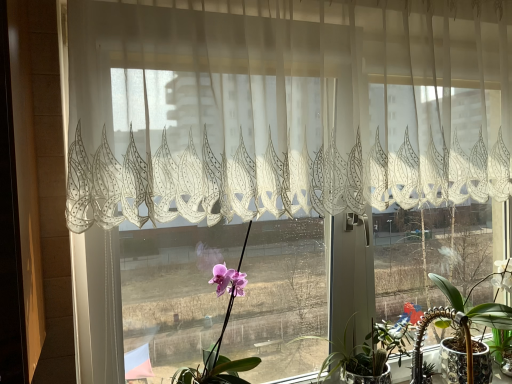
In order to face translucent white lace curtain at upper center, should I rotate leftwards or rightwards?

Turn right approximately 11.811 degrees to face it.

Describe the element at coordinates (475, 306) in the screenshot. I see `white glossy pot at lower right, marked as the third houseplant in a left-to-right arrangement` at that location.

At what (x,y) coordinates should I click in order to perform the action: click on green glossy succulent at lower right, the second houseplant positioned from the right. Please return your answer as a coordinate pair (x, y). Looking at the image, I should click on (371, 350).

Is white glossy pot at lower right, the 1th houseplant in the right-to-left sequence, inside pink matte orchid at center, which is the 3th houseplant in right-to-left order?

No, white glossy pot at lower right, the 1th houseplant in the right-to-left sequence, is not inside pink matte orchid at center, which is the 3th houseplant in right-to-left order.

This screenshot has width=512, height=384. Identify the location of houseplant that is the 2nd object to the left of the white glossy pot at lower right, marked as the third houseplant in a left-to-right arrangement, starting at the anchor. (222, 331).

Measure the distance between pink matte orchid at center, which ranks as the 1th houseplant in left-to-right order, and white glossy pot at lower right, the 1th houseplant in the right-to-left sequence.

They are 29.45 inches apart.

Considering the relative sizes of pink matte orchid at center, which ranks as the 1th houseplant in left-to-right order, and white glossy pot at lower right, the 1th houseplant in the right-to-left sequence, in the image provided, is pink matte orchid at center, which ranks as the 1th houseplant in left-to-right order, bigger than white glossy pot at lower right, the 1th houseplant in the right-to-left sequence,?

Indeed, pink matte orchid at center, which ranks as the 1th houseplant in left-to-right order, has a larger size compared to white glossy pot at lower right, the 1th houseplant in the right-to-left sequence.

What's the angular difference between pink matte orchid at center, which is the 3th houseplant in right-to-left order, and green glossy succulent at lower right, the second houseplant positioned from the right,'s facing directions?

0.000122 degrees separate the facing orientations of pink matte orchid at center, which is the 3th houseplant in right-to-left order, and green glossy succulent at lower right, the second houseplant positioned from the right.

Is pink matte orchid at center, which is the 3th houseplant in right-to-left order, directly adjacent to green glossy succulent at lower right, which ranks as the 2th houseplant in left-to-right order?

No, pink matte orchid at center, which is the 3th houseplant in right-to-left order, is not beside green glossy succulent at lower right, which ranks as the 2th houseplant in left-to-right order.

Considering the sizes of objects pink matte orchid at center, which ranks as the 1th houseplant in left-to-right order, and green glossy succulent at lower right, which ranks as the 2th houseplant in left-to-right order, in the image provided, who is wider, pink matte orchid at center, which ranks as the 1th houseplant in left-to-right order, or green glossy succulent at lower right, which ranks as the 2th houseplant in left-to-right order,?

Wider between the two is pink matte orchid at center, which ranks as the 1th houseplant in left-to-right order.

There is a green glossy succulent at lower right, which ranks as the 2th houseplant in left-to-right order. At what (x,y) coordinates should I click in order to perform the action: click on the 2nd houseplant above it (from a real-world perspective). Please return your answer as a coordinate pair (x, y). Looking at the image, I should click on (222, 331).

Is translucent white lace curtain at upper center situated inside white glossy pot at lower right, the 1th houseplant in the right-to-left sequence, or outside?

translucent white lace curtain at upper center is not inside white glossy pot at lower right, the 1th houseplant in the right-to-left sequence, it's outside.

Which is more to the left, translucent white lace curtain at upper center or white glossy pot at lower right, marked as the third houseplant in a left-to-right arrangement?

From the viewer's perspective, translucent white lace curtain at upper center appears more on the left side.

Who is bigger, translucent white lace curtain at upper center or white glossy pot at lower right, the 1th houseplant in the right-to-left sequence?

translucent white lace curtain at upper center is bigger.

Considering their positions, is translucent white lace curtain at upper center located in front of or behind white glossy pot at lower right, marked as the third houseplant in a left-to-right arrangement?

translucent white lace curtain at upper center is positioned closer to the viewer than white glossy pot at lower right, marked as the third houseplant in a left-to-right arrangement.

This screenshot has height=384, width=512. What are the coordinates of `the 1st houseplant counting from the left side of the white glossy pot at lower right, the 1th houseplant in the right-to-left sequence` in the screenshot? It's located at (371, 350).

Does green glossy succulent at lower right, the second houseplant positioned from the right, have a lesser height compared to white glossy pot at lower right, marked as the third houseplant in a left-to-right arrangement?

Yes, green glossy succulent at lower right, the second houseplant positioned from the right, is shorter than white glossy pot at lower right, marked as the third houseplant in a left-to-right arrangement.

Is the position of green glossy succulent at lower right, which ranks as the 2th houseplant in left-to-right order, less distant than that of white glossy pot at lower right, the 1th houseplant in the right-to-left sequence?

Yes.

Do you think green glossy succulent at lower right, the second houseplant positioned from the right, is within white glossy pot at lower right, the 1th houseplant in the right-to-left sequence, or outside of it?

green glossy succulent at lower right, the second houseplant positioned from the right, lies outside white glossy pot at lower right, the 1th houseplant in the right-to-left sequence.

In the scene shown: From the image's perspective, does green glossy succulent at lower right, which ranks as the 2th houseplant in left-to-right order, appear lower than pink matte orchid at center, which ranks as the 1th houseplant in left-to-right order?

Correct, green glossy succulent at lower right, which ranks as the 2th houseplant in left-to-right order, appears lower than pink matte orchid at center, which ranks as the 1th houseplant in left-to-right order, in the image.

In the scene shown: Choose the correct answer: Is green glossy succulent at lower right, which ranks as the 2th houseplant in left-to-right order, inside pink matte orchid at center, which is the 3th houseplant in right-to-left order, or outside it?

green glossy succulent at lower right, which ranks as the 2th houseplant in left-to-right order, lies outside pink matte orchid at center, which is the 3th houseplant in right-to-left order.

Where is `houseplant to the left of green glossy succulent at lower right, which ranks as the 2th houseplant in left-to-right order`? houseplant to the left of green glossy succulent at lower right, which ranks as the 2th houseplant in left-to-right order is located at coordinates (222, 331).

Which object is further away from the camera taking this photo, green glossy succulent at lower right, which ranks as the 2th houseplant in left-to-right order, or pink matte orchid at center, which ranks as the 1th houseplant in left-to-right order?

Positioned behind is green glossy succulent at lower right, which ranks as the 2th houseplant in left-to-right order.

Considering the sizes of objects green glossy succulent at lower right, the second houseplant positioned from the right, and translucent white lace curtain at upper center in the image provided, who is wider, green glossy succulent at lower right, the second houseplant positioned from the right, or translucent white lace curtain at upper center?

With larger width is green glossy succulent at lower right, the second houseplant positioned from the right.

Locate an element on the screen. This screenshot has width=512, height=384. curtain that appears in front of the green glossy succulent at lower right, the second houseplant positioned from the right is located at coordinates (283, 111).

Measure the distance from green glossy succulent at lower right, which ranks as the 2th houseplant in left-to-right order, to translucent white lace curtain at upper center.

The distance of green glossy succulent at lower right, which ranks as the 2th houseplant in left-to-right order, from translucent white lace curtain at upper center is 29.16 inches.

From the image's perspective, is green glossy succulent at lower right, which ranks as the 2th houseplant in left-to-right order, on translucent white lace curtain at upper center?

No, from the image's perspective, green glossy succulent at lower right, which ranks as the 2th houseplant in left-to-right order, is not above translucent white lace curtain at upper center.

From the image's perspective, is pink matte orchid at center, which ranks as the 1th houseplant in left-to-right order, over translucent white lace curtain at upper center?

No.

Who is taller, pink matte orchid at center, which ranks as the 1th houseplant in left-to-right order, or translucent white lace curtain at upper center?

translucent white lace curtain at upper center is taller.

Which is behind, pink matte orchid at center, which ranks as the 1th houseplant in left-to-right order, or translucent white lace curtain at upper center?

pink matte orchid at center, which ranks as the 1th houseplant in left-to-right order, is further from the camera.

From a real-world perspective, is pink matte orchid at center, which is the 3th houseplant in right-to-left order, beneath translucent white lace curtain at upper center?

Yes, from a real-world perspective, pink matte orchid at center, which is the 3th houseplant in right-to-left order, is beneath translucent white lace curtain at upper center.

From the image's perspective, which houseplant is the 1st one below the pink matte orchid at center, which ranks as the 1th houseplant in left-to-right order? Please provide its 2D coordinates.

[(475, 306)]

I want to click on the 1st houseplant to the right of the pink matte orchid at center, which ranks as the 1th houseplant in left-to-right order, counting from the anchor's position, so click(371, 350).

Based on their spatial positions, is green glossy succulent at lower right, the second houseplant positioned from the right, or pink matte orchid at center, which ranks as the 1th houseplant in left-to-right order, further from translucent white lace curtain at upper center?

green glossy succulent at lower right, the second houseplant positioned from the right, lies further to translucent white lace curtain at upper center than the other object.

From the image, which object appears to be nearer to green glossy succulent at lower right, the second houseplant positioned from the right, translucent white lace curtain at upper center or pink matte orchid at center, which ranks as the 1th houseplant in left-to-right order?

Based on the image, pink matte orchid at center, which ranks as the 1th houseplant in left-to-right order, appears to be nearer to green glossy succulent at lower right, the second houseplant positioned from the right.

When comparing their distances from white glossy pot at lower right, the 1th houseplant in the right-to-left sequence, does translucent white lace curtain at upper center or green glossy succulent at lower right, which ranks as the 2th houseplant in left-to-right order, seem further?

translucent white lace curtain at upper center lies further to white glossy pot at lower right, the 1th houseplant in the right-to-left sequence, than the other object.

Considering their positions, is pink matte orchid at center, which is the 3th houseplant in right-to-left order, positioned further to white glossy pot at lower right, marked as the third houseplant in a left-to-right arrangement, than green glossy succulent at lower right, which ranks as the 2th houseplant in left-to-right order?

pink matte orchid at center, which is the 3th houseplant in right-to-left order, is further to white glossy pot at lower right, marked as the third houseplant in a left-to-right arrangement.

Looking at the image, which one is located closer to green glossy succulent at lower right, which ranks as the 2th houseplant in left-to-right order, pink matte orchid at center, which is the 3th houseplant in right-to-left order, or white glossy pot at lower right, marked as the third houseplant in a left-to-right arrangement?

white glossy pot at lower right, marked as the third houseplant in a left-to-right arrangement, is closer to green glossy succulent at lower right, which ranks as the 2th houseplant in left-to-right order.

Estimate the real-world distances between objects in this image. Which object is further from green glossy succulent at lower right, the second houseplant positioned from the right, white glossy pot at lower right, the 1th houseplant in the right-to-left sequence, or translucent white lace curtain at upper center?

Among the two, translucent white lace curtain at upper center is located further to green glossy succulent at lower right, the second houseplant positioned from the right.

Which object lies nearer to the anchor point green glossy succulent at lower right, which ranks as the 2th houseplant in left-to-right order, white glossy pot at lower right, the 1th houseplant in the right-to-left sequence, or pink matte orchid at center, which is the 3th houseplant in right-to-left order?

white glossy pot at lower right, the 1th houseplant in the right-to-left sequence.

Consider the image. Looking at the image, which one is located closer to white glossy pot at lower right, marked as the third houseplant in a left-to-right arrangement, green glossy succulent at lower right, the second houseplant positioned from the right, or pink matte orchid at center, which ranks as the 1th houseplant in left-to-right order?

green glossy succulent at lower right, the second houseplant positioned from the right, lies closer to white glossy pot at lower right, marked as the third houseplant in a left-to-right arrangement, than the other object.

Where is `houseplant between pink matte orchid at center, which is the 3th houseplant in right-to-left order, and white glossy pot at lower right, marked as the third houseplant in a left-to-right arrangement, in the horizontal direction`? The image size is (512, 384). houseplant between pink matte orchid at center, which is the 3th houseplant in right-to-left order, and white glossy pot at lower right, marked as the third houseplant in a left-to-right arrangement, in the horizontal direction is located at coordinates (371, 350).

Image resolution: width=512 pixels, height=384 pixels. I want to click on curtain located between pink matte orchid at center, which is the 3th houseplant in right-to-left order, and white glossy pot at lower right, marked as the third houseplant in a left-to-right arrangement, in the left-right direction, so click(283, 111).